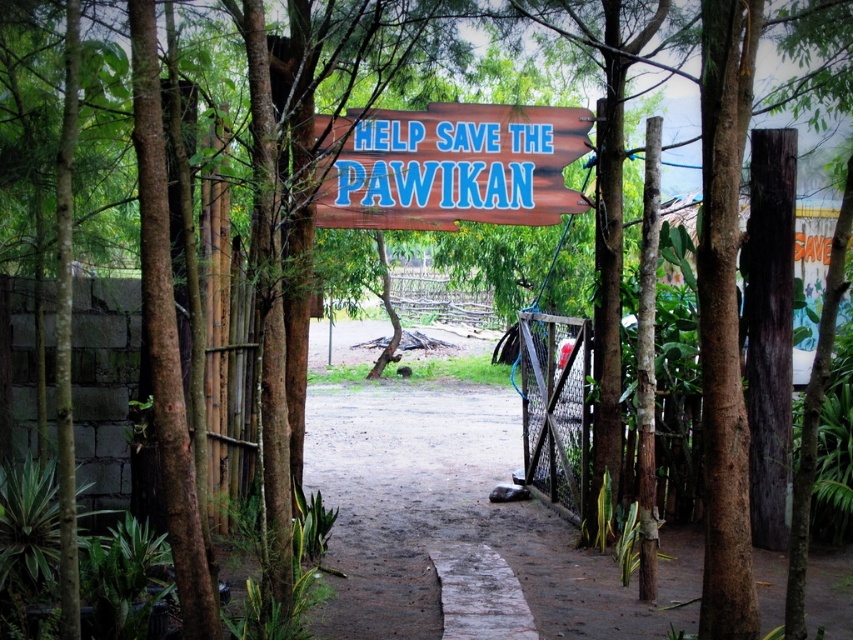
Question: Which point is closer to the camera?

Choices:
 (A) (397, 460)
 (B) (560, 435)

Answer: (B)

Question: Which point is farther to the camera?

Choices:
 (A) (431, 502)
 (B) (543, 122)
 (C) (550, 467)

Answer: (A)

Question: From the image, what is the correct spatial relationship of dull brown dirt at center in relation to wooden sign at center?

Choices:
 (A) below
 (B) above

Answer: (A)

Question: Considering the relative positions of dull brown dirt at center and wooden sign at center in the image provided, where is dull brown dirt at center located with respect to wooden sign at center?

Choices:
 (A) above
 (B) below

Answer: (B)

Question: Is dull brown dirt at center to the left of wooden sign at center from the viewer's perspective?

Choices:
 (A) no
 (B) yes

Answer: (A)

Question: Which object is positioned closest to the dull brown dirt at center?

Choices:
 (A) wire mesh gate at center
 (B) wooden sign at center

Answer: (A)